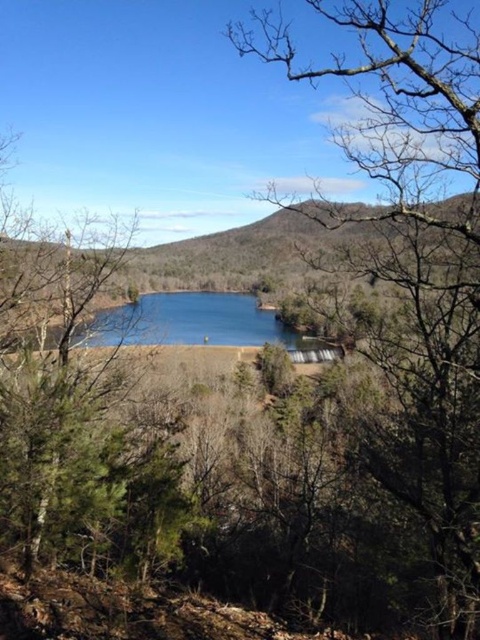
Can you confirm if bare branches at center is positioned to the left of blue glass water at center?

Incorrect, bare branches at center is not on the left side of blue glass water at center.

Who is taller, bare branches at center or blue glass water at center?

bare branches at center

Which is in front, point (432, 0) or point (265, 321)?

Point (432, 0) is more forward.

Where is `bare branches at center`? Image resolution: width=480 pixels, height=640 pixels. bare branches at center is located at coordinates (414, 260).